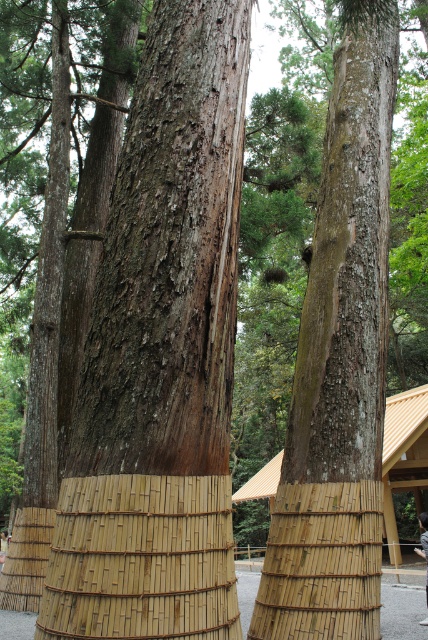
Is the position of brown rough bark tree trunk at center less distant than that of bamboo mat at center?

Yes, brown rough bark tree trunk at center is in front of bamboo mat at center.

Does brown rough bark tree trunk at center have a greater width compared to bamboo mat at center?

No, brown rough bark tree trunk at center is not wider than bamboo mat at center.

The height and width of the screenshot is (640, 428). I want to click on brown rough bark tree trunk at center, so click(x=160, y=355).

Does smooth brown bark at center have a greater width compared to bamboo mat at center?

In fact, smooth brown bark at center might be narrower than bamboo mat at center.

Is point (338, 333) closer to viewer compared to point (425, 461)?

Yes, it is.

Between point (321, 392) and point (235, 499), which one is positioned in front?

Point (321, 392) is in front.

I want to click on smooth brown bark at center, so [338, 364].

Can you confirm if brown rough bark tree trunk at center is shorter than smooth brown bark at center?

No, brown rough bark tree trunk at center is not shorter than smooth brown bark at center.

Is brown rough bark tree trunk at center to the left of smooth brown bark at center from the viewer's perspective?

Indeed, brown rough bark tree trunk at center is positioned on the left side of smooth brown bark at center.

This screenshot has width=428, height=640. What do you see at coordinates (160, 355) in the screenshot? I see `brown rough bark tree trunk at center` at bounding box center [160, 355].

What are the coordinates of `brown rough bark tree trunk at center` in the screenshot? It's located at (160, 355).